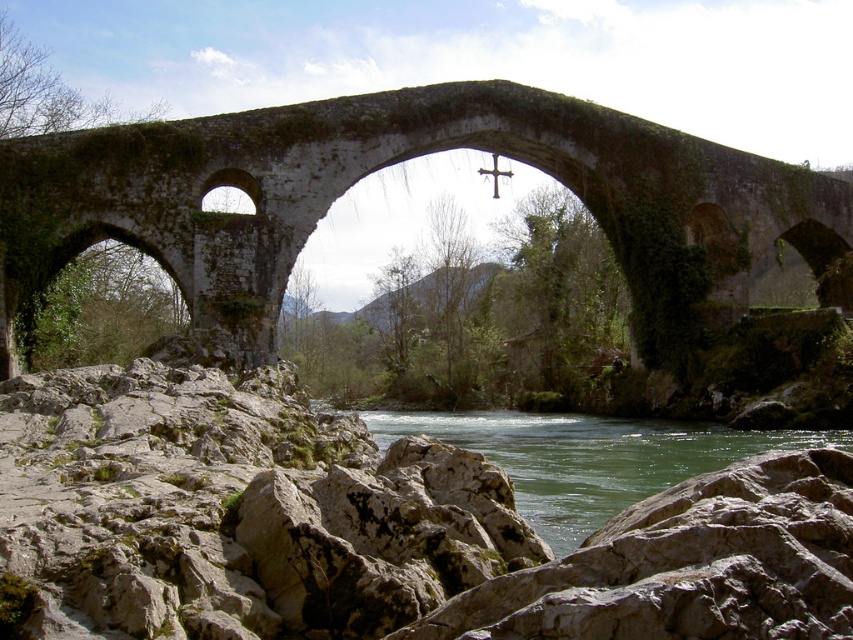
You are a tourist standing on the path leading to the stone arch bridge at center and the metallic cross at center. Which object is closer to your left side?

The metallic cross at center is closer to your left side because the stone arch bridge at center is positioned on the right side of the metallic cross at center.

You are standing on the path leading to the stone arch bridge at center and the green stone river at center. Which one is closer to you?

The stone arch bridge at center is closer to you because it is positioned further to the viewer than the green stone river at center, meaning the bridge is nearer in the scene.

Based on the photo, you are a hiker carrying a heavy backpack and need to cross the rocky terrain in the foreground. You see the gray rough rock at lower center and the green stone river at center. Which one is more suitable to step on for stability?

The gray rough rock at lower center is more suitable to step on for stability because it has a larger size compared to the green stone river at center, providing a more stable footing.